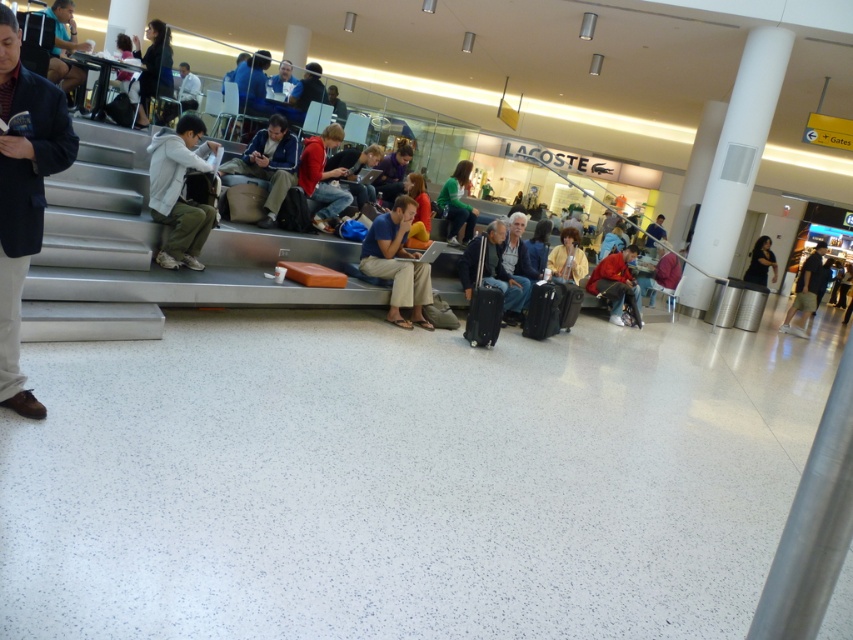
Looking at this image, you are standing in the airport terminal waiting area and see the dark blue blazer at left. If you want to walk towards it, which direction should you move relative to your current position?

The dark blue blazer at left is located at point coordinates, so you should move to your left to reach it.

You are standing in the airport terminal waiting area and want to move from point A to point B. Point A is at coordinate point (506, 253) and point B is at coordinate point (578, 307). Considering the layout of the terminal, which point is closer to you when you first enter the scene?

Point A at coordinate point (506, 253) is closer to the camera than point B at coordinate point (578, 307), so when you first enter the scene, point A is closer to you.

You are a traveler standing in the airport terminal waiting area and you see the light blue jeans at center and the matte yellow jacket at center. Which item of clothing is taller?

The light blue jeans at center is taller than the matte yellow jacket at center.